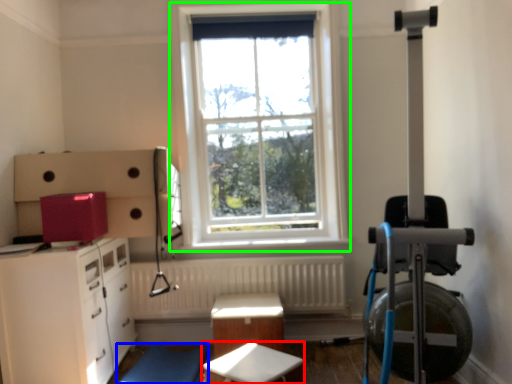
Question: Which object is positioned closest to table (highlighted by a red box)? Select from swivel chair (highlighted by a blue box) and window (highlighted by a green box).

Choices:
 (A) swivel chair
 (B) window

Answer: (A)